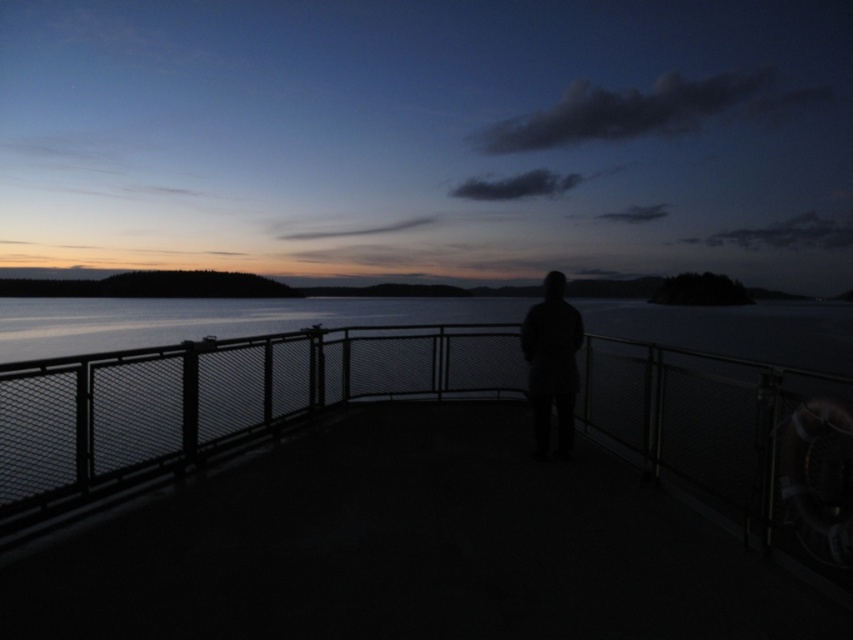
In the scene shown: You are a photographer positioned on the walkway. You see the silhouette person at center and the dark matte figure at center. Which one is positioned to the left?

The silhouette person at center is to the left of the dark matte figure at center.

You are a photographer trying to capture the dark matte figure at center and the metal mesh fence at center in the same frame. Based on their positions, which object should you adjust your camera to focus on first to ensure both are in the frame?

The metal mesh fence at center is positioned on the left side of dark matte figure at center, so you should focus on the dark matte figure at center first to ensure both are within the frame.